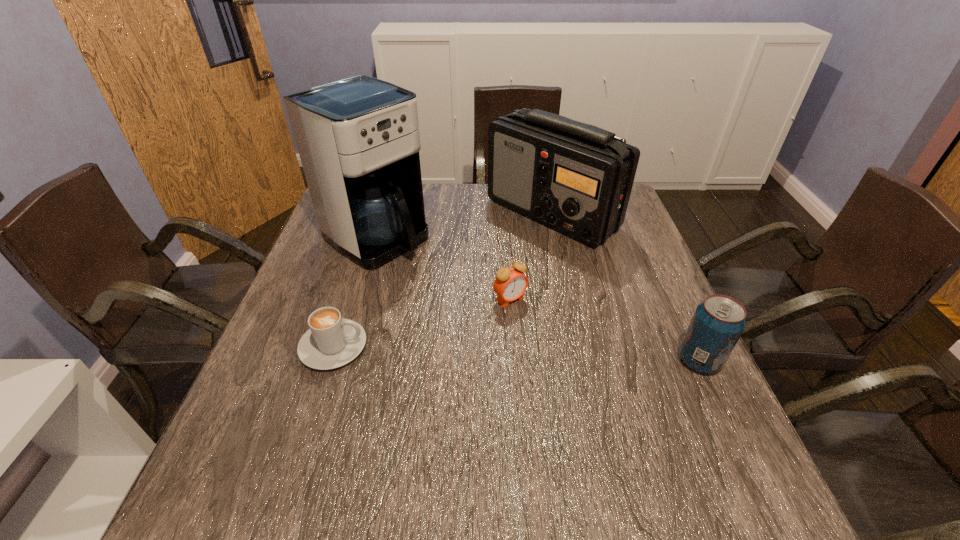
The height and width of the screenshot is (540, 960). Identify the location of vacant space on the desktop that is between the shortest object and the pop soda and is positioned on the front panel of the tallest object. (556, 355).

Image resolution: width=960 pixels, height=540 pixels. Find the location of `vacant spot on the desktop that is between the shortest object and the third shortest object and is positioned on the front panel of the radio receiver`. vacant spot on the desktop that is between the shortest object and the third shortest object and is positioned on the front panel of the radio receiver is located at coordinates (521, 353).

Where is `free space on the desktop that is between the shortest object and the rightmost object and is positioned on the face of the second shortest object`? Image resolution: width=960 pixels, height=540 pixels. free space on the desktop that is between the shortest object and the rightmost object and is positioned on the face of the second shortest object is located at coordinates (566, 355).